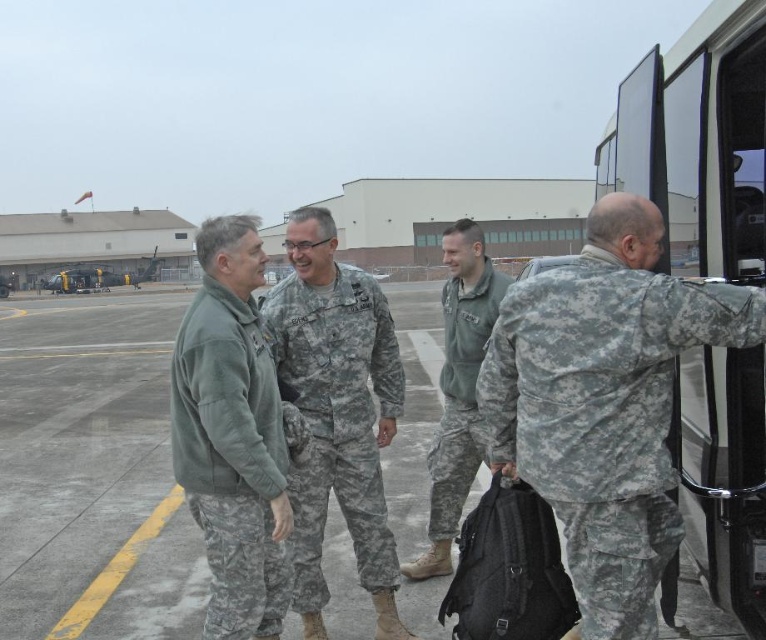
Question: Which is farther from the camouflage uniform at center?

Choices:
 (A) green fleece jacket at left
 (B) camouflage fabric tarmac at center
 (C) camouflage fabric uniform at center
 (D) camouflage uniform at right

Answer: (B)

Question: Estimate the real-world distances between objects in this image. Which object is farther from the camouflage uniform at right?

Choices:
 (A) camouflage uniform at center
 (B) camouflage fabric uniform at center
 (C) camouflage fabric tarmac at center
 (D) green fleece jacket at left

Answer: (C)

Question: Is camouflage fabric tarmac at center to the left of camouflage uniform at right from the viewer's perspective?

Choices:
 (A) no
 (B) yes

Answer: (B)

Question: Is camouflage fabric tarmac at center to the left of green fleece jacket at left from the viewer's perspective?

Choices:
 (A) yes
 (B) no

Answer: (A)

Question: Does camouflage uniform at right have a smaller size compared to camouflage fabric uniform at center?

Choices:
 (A) yes
 (B) no

Answer: (B)

Question: Which object is positioned closest to the camouflage uniform at right?

Choices:
 (A) camouflage uniform at center
 (B) green fleece jacket at left
 (C) camouflage fabric uniform at center
 (D) camouflage fabric tarmac at center

Answer: (C)